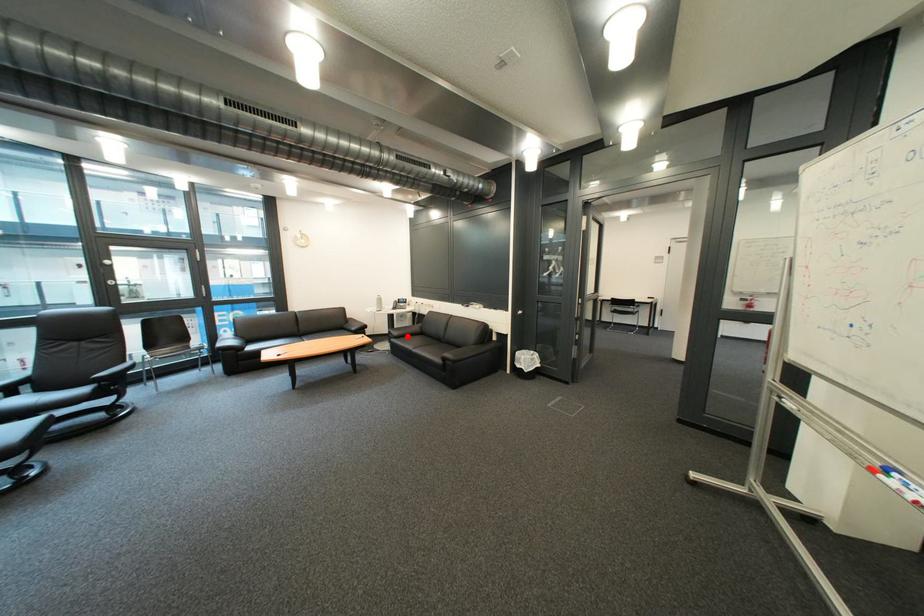
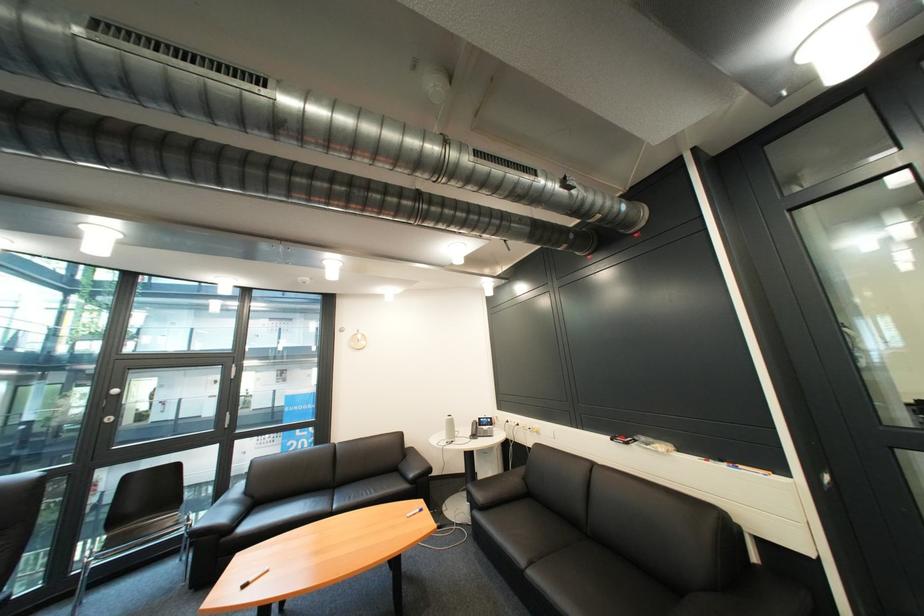
Locate, in the second image, the point that corresponds to the highlighted location in the first image.

(491, 504)